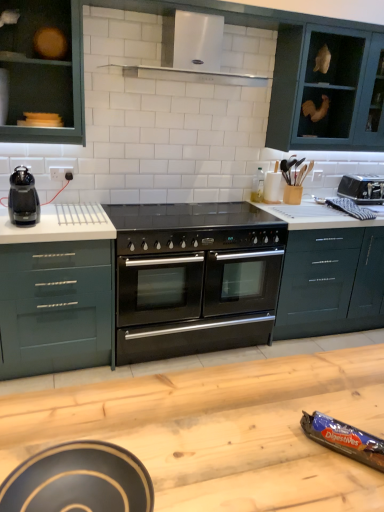
What is the approximate height of black plastic toaster at upper right, the third appliance viewed from the left?

21.98 centimeters.

Where is `glossy dark green drawer at center-right, the second drawer in the left-to-right sequence`? This screenshot has height=512, width=384. glossy dark green drawer at center-right, the second drawer in the left-to-right sequence is located at coordinates tap(331, 282).

What is the approximate height of matte black bowl at lower left, the first appliance positioned from the bottom?

6.69 centimeters.

Locate an element on the screen. This screenshot has height=512, width=384. green matte cabinet at upper right, which appears as the 3th cabinetry when viewed from the left is located at coordinates (327, 89).

What is the approximate width of green matte cabinet at upper right, the 1th cabinetry when ordered from right to left?

The width of green matte cabinet at upper right, the 1th cabinetry when ordered from right to left, is 17.04 inches.

In order to click on black plastic toaster at upper right, which is the 1th appliance in right-to-left order in this screenshot , I will do `click(362, 188)`.

How different are the orientations of green matte cabinet at upper right, which appears as the 3th cabinetry when viewed from the left, and black plastic coffee maker at left in degrees?

green matte cabinet at upper right, which appears as the 3th cabinetry when viewed from the left, and black plastic coffee maker at left are facing 4.86 degrees away from each other.

Is green matte cabinet at upper right, the 1th cabinetry when ordered from right to left, next to black plastic coffee maker at left and touching it?

green matte cabinet at upper right, the 1th cabinetry when ordered from right to left, is not next to black plastic coffee maker at left, and they're not touching.

Is green matte cabinet at upper right, which appears as the 3th cabinetry when viewed from the left, in front of black plastic coffee maker at left?

No, it is behind black plastic coffee maker at left.

Looking at their sizes, would you say green matte cabinet at upper right, the 1th cabinetry when ordered from right to left, is wider or thinner than black plastic coffee maker at left?

green matte cabinet at upper right, the 1th cabinetry when ordered from right to left, is wider than black plastic coffee maker at left.

Is black plastic coffee maker at left not within black matte oven at center?

Yes, black plastic coffee maker at left is not within black matte oven at center.

Does black plastic coffee maker at left appear on the right side of black matte oven at center?

No, black plastic coffee maker at left is not to the right of black matte oven at center.

Is there a large distance between black plastic coffee maker at left and black matte oven at center?

No.

Is black plastic coffee maker at left further to camera compared to black matte oven at center?

That is False.

Do you think matte green cabinet at upper left, positioned as the first cabinetry in left-to-right order, is within glossy dark green drawer at center-right, the second drawer in the left-to-right sequence, or outside of it?

matte green cabinet at upper left, positioned as the first cabinetry in left-to-right order, exists outside the volume of glossy dark green drawer at center-right, the second drawer in the left-to-right sequence.

From the image's perspective, between matte green cabinet at upper left, the third cabinetry positioned from the right, and glossy dark green drawer at center-right, the first drawer in the right-to-left sequence, which one is located above?

matte green cabinet at upper left, the third cabinetry positioned from the right.

Is matte green cabinet at upper left, positioned as the first cabinetry in left-to-right order, wider than glossy dark green drawer at center-right, the first drawer in the right-to-left sequence?

No.

Which is behind, green matte cabinet at upper center, acting as the second cabinetry starting from the right, or black plastic coffee maker at left?

green matte cabinet at upper center, acting as the second cabinetry starting from the right, is further away from the camera.

What's the angular difference between green matte cabinet at upper center, positioned as the 2th cabinetry in left-to-right order, and black plastic coffee maker at left's facing directions?

green matte cabinet at upper center, positioned as the 2th cabinetry in left-to-right order, and black plastic coffee maker at left are facing 5.46 degrees away from each other.

Looking at this image, from the image's perspective, is green matte cabinet at upper center, positioned as the 2th cabinetry in left-to-right order, beneath black plastic coffee maker at left?

Incorrect, from the image's perspective, green matte cabinet at upper center, positioned as the 2th cabinetry in left-to-right order, is higher than black plastic coffee maker at left.

The height and width of the screenshot is (512, 384). Identify the location of kitchen appliance that is on the left side of green matte cabinet at upper center, acting as the second cabinetry starting from the right. (23, 198).

Is blue foil digestives at lower right, which ranks as the second appliance in left-to-right order, behind matte green cabinet at upper left, the third cabinetry positioned from the right?

No, the depth of blue foil digestives at lower right, which ranks as the second appliance in left-to-right order, is less than that of matte green cabinet at upper left, the third cabinetry positioned from the right.

Are blue foil digestives at lower right, the second appliance from the front, and matte green cabinet at upper left, positioned as the first cabinetry in left-to-right order, located far from each other?

blue foil digestives at lower right, the second appliance from the front, is far away from matte green cabinet at upper left, positioned as the first cabinetry in left-to-right order.

In order to click on the 1st cabinetry behind the blue foil digestives at lower right, the second appliance from the front in this screenshot , I will do `click(43, 71)`.

Considering the relative positions of blue foil digestives at lower right, the 2th appliance from the right, and matte green cabinet at upper left, positioned as the first cabinetry in left-to-right order, in the image provided, is blue foil digestives at lower right, the 2th appliance from the right, to the right of matte green cabinet at upper left, positioned as the first cabinetry in left-to-right order, from the viewer's perspective?

Yes.

Does white stainless steel exhaust hood at upper center have a greater width compared to matte green cabinet at upper left, positioned as the first cabinetry in left-to-right order?

Indeed, white stainless steel exhaust hood at upper center has a greater width compared to matte green cabinet at upper left, positioned as the first cabinetry in left-to-right order.

Which point is more forward, (196,19) or (80,98)?

The point (196,19) is more forward.

From the image's perspective, who appears lower, white stainless steel exhaust hood at upper center or matte green cabinet at upper left, the third cabinetry positioned from the right?

matte green cabinet at upper left, the third cabinetry positioned from the right, appears lower in the image.

From a real-world perspective, count 2nd cabinetrys downward from the white stainless steel exhaust hood at upper center and point to it. Please provide its 2D coordinates.

[(43, 71)]

Are matte black bowl at lower left, arranged as the third appliance when viewed from the back, and black plastic toaster at upper right, which is the 1th appliance in right-to-left order, located far from each other?

matte black bowl at lower left, arranged as the third appliance when viewed from the back, is far away from black plastic toaster at upper right, which is the 1th appliance in right-to-left order.

Is matte black bowl at lower left, placed as the first appliance when sorted from left to right, positioned in front of black plastic toaster at upper right, which is the first appliance in back-to-front order?

Yes, the depth of matte black bowl at lower left, placed as the first appliance when sorted from left to right, is less than that of black plastic toaster at upper right, which is the first appliance in back-to-front order.

Considering the relative positions of matte black bowl at lower left, placed as the first appliance when sorted from left to right, and black plastic toaster at upper right, which is the 1th appliance in right-to-left order, in the image provided, is matte black bowl at lower left, placed as the first appliance when sorted from left to right, to the left or to the right of black plastic toaster at upper right, which is the 1th appliance in right-to-left order,?

matte black bowl at lower left, placed as the first appliance when sorted from left to right, is positioned on black plastic toaster at upper right, which is the 1th appliance in right-to-left order,'s left side.

Find the location of a particular element. The width and height of the screenshot is (384, 512). kitchen appliance on the left of green matte cabinet at upper right, the 1th cabinetry when ordered from right to left is located at coordinates (23, 198).

Find the location of `kitchen appliance above the black matte oven at center (from a real-world perspective)`. kitchen appliance above the black matte oven at center (from a real-world perspective) is located at coordinates (23, 198).

Which object lies nearer to the anchor point black plastic coffee maker at left, wooden at center or black glass gas stove at center?

black glass gas stove at center lies closer to black plastic coffee maker at left than the other object.

Looking at this image, looking at the image, which one is located further to green matte cabinet at upper center, positioned as the 2th cabinetry in left-to-right order, blue foil digestives at lower right, the second appliance from the front, or white stainless steel exhaust hood at upper center?

The object further to green matte cabinet at upper center, positioned as the 2th cabinetry in left-to-right order, is blue foil digestives at lower right, the second appliance from the front.

Based on their spatial positions, is black plastic toaster at upper right, which is the 1th appliance in right-to-left order, or black plastic coffee maker at left closer to black glass gas stove at center?

The object closer to black glass gas stove at center is black plastic coffee maker at left.

Looking at the image, which one is located further to black glass gas stove at center, glossy dark green drawer at center-right, the second drawer in the left-to-right sequence, or green matte cabinet at upper right, which appears as the 3th cabinetry when viewed from the left?

The object further to black glass gas stove at center is green matte cabinet at upper right, which appears as the 3th cabinetry when viewed from the left.

Which object lies nearer to the anchor point white stainless steel exhaust hood at upper center, green matte cabinet at upper right, which appears as the 3th cabinetry when viewed from the left, or black glass gas stove at center?

Based on the image, green matte cabinet at upper right, which appears as the 3th cabinetry when viewed from the left, appears to be nearer to white stainless steel exhaust hood at upper center.

Looking at this image, from the image, which object appears to be nearer to glossy dark green drawer at center-right, the first drawer in the right-to-left sequence, green matte cabinet at upper right, the 1th cabinetry when ordered from right to left, or matte black bowl at lower left, the first appliance positioned from the bottom?

green matte cabinet at upper right, the 1th cabinetry when ordered from right to left, is positioned closer to the anchor glossy dark green drawer at center-right, the first drawer in the right-to-left sequence.

From the image, which object appears to be farther from matte black bowl at lower left, arranged as the third appliance when viewed from the back, matte green cabinet at upper left, the third cabinetry positioned from the right, or green matte cabinet at upper right, the 1th cabinetry when ordered from right to left?

green matte cabinet at upper right, the 1th cabinetry when ordered from right to left, is further to matte black bowl at lower left, arranged as the third appliance when viewed from the back.

Estimate the real-world distances between objects in this image. Which object is closer to green matte cabinet at upper center, acting as the second cabinetry starting from the right, matte black bowl at lower left, arranged as the 3th appliance when viewed from the right, or green matte drawer at left, which ranks as the first drawer in left-to-right order?

green matte drawer at left, which ranks as the first drawer in left-to-right order.

Locate an element on the screen. This screenshot has height=512, width=384. exhaust hood located between black glass gas stove at center and glossy dark green drawer at center-right, the first drawer in the right-to-left sequence, in the left-right direction is located at coordinates (192, 53).

I want to click on exhaust hood between black plastic coffee maker at left and green matte cabinet at upper center, acting as the second cabinetry starting from the right, in the horizontal direction, so pos(192,53).

Find the location of a particular element. Image resolution: width=384 pixels, height=512 pixels. exhaust hood between black glass gas stove at center and green matte cabinet at upper right, the 1th cabinetry when ordered from right to left, from left to right is located at coordinates (192, 53).

The height and width of the screenshot is (512, 384). Identify the location of appliance located between wooden at center and black matte oven at center in the depth direction. (344, 439).